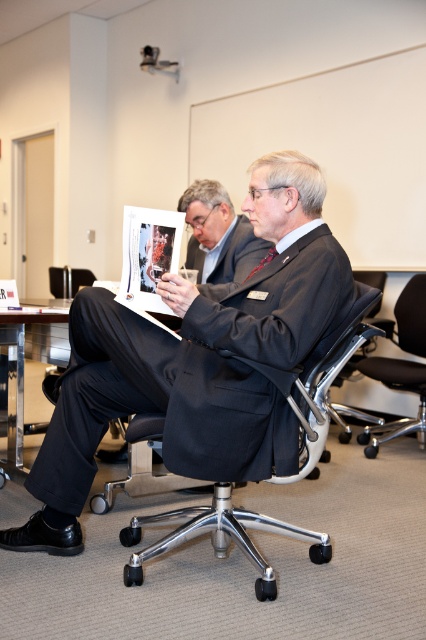
You are an event organizer who needs to ensure all seating arrangements accommodate wheelchair access. The wheelchair requires a minimum seat height of 45 cm. Given the metallic silver swivel chair at center and the black matte suit at center, which chair meets the accessibility requirement?

The metallic silver swivel chair at center is much taller than the black matte suit at center. Since the wheelchair requires a minimum seat height of 45 cm, the metallic silver swivel chair at center likely meets the accessibility requirement as it is taller.

What are the coordinates of the white paper at center?

The white paper at center is located at coordinates point (147, 256).